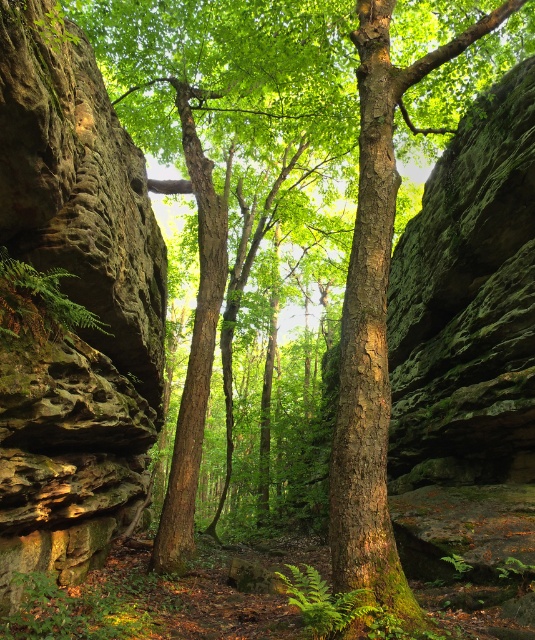
Question: Which object is closer to the camera taking this photo?

Choices:
 (A) rough textured rock at left
 (B) green mossy fern at left

Answer: (B)

Question: Among these points, which one is farthest from the camera?

Choices:
 (A) (20, 502)
 (B) (49, 321)

Answer: (B)

Question: Which of the following is the farthest from the observer?

Choices:
 (A) (57, 97)
 (B) (72, 275)

Answer: (B)

Question: Is rough textured rock at left smaller than green mossy fern at left?

Choices:
 (A) no
 (B) yes

Answer: (B)

Question: Where is rough textured rock at left located in relation to green mossy fern at left in the image?

Choices:
 (A) below
 (B) above

Answer: (A)

Question: Is rough textured rock at left positioned behind green mossy fern at left?

Choices:
 (A) no
 (B) yes

Answer: (B)